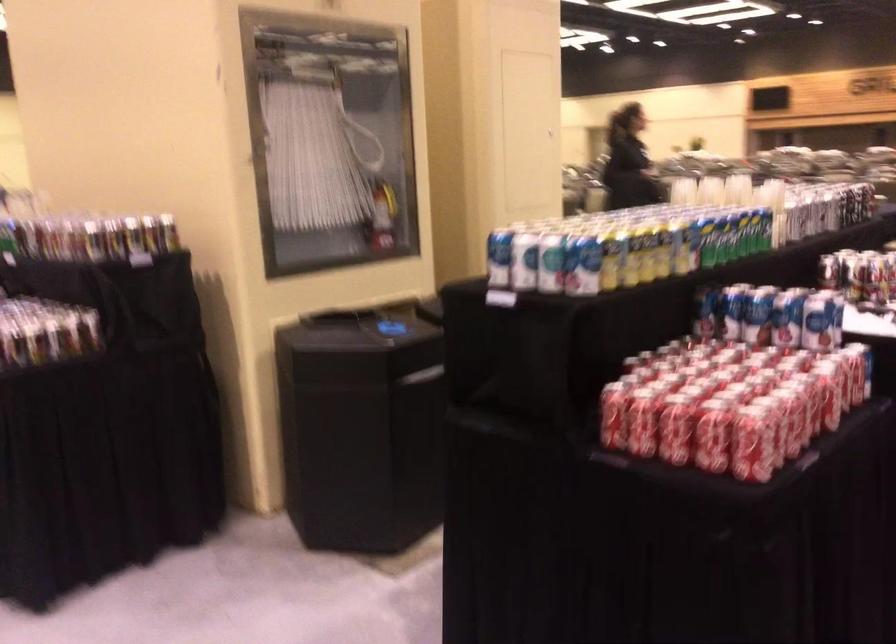
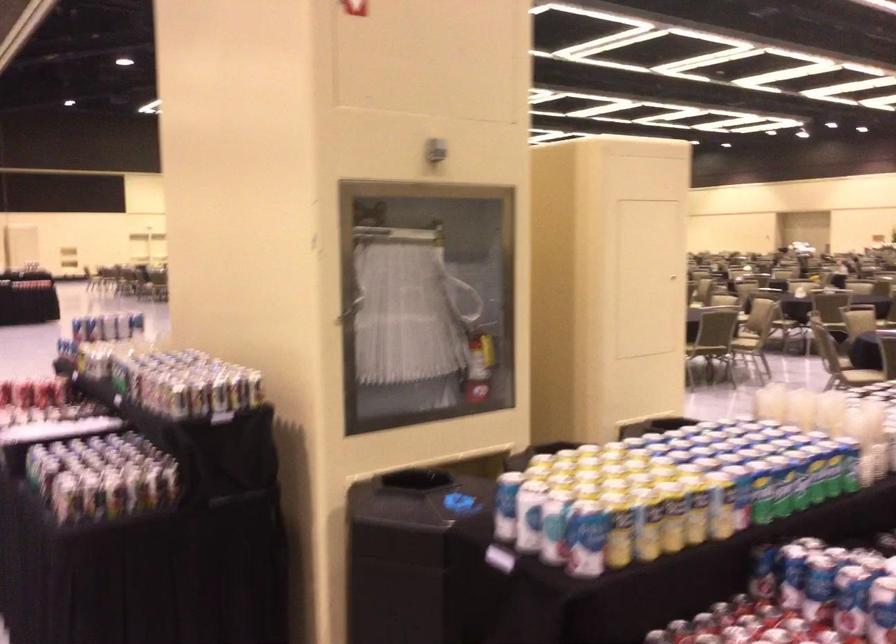
Where in the second image is the point corresponding to (x=375, y=328) from the first image?

(442, 502)